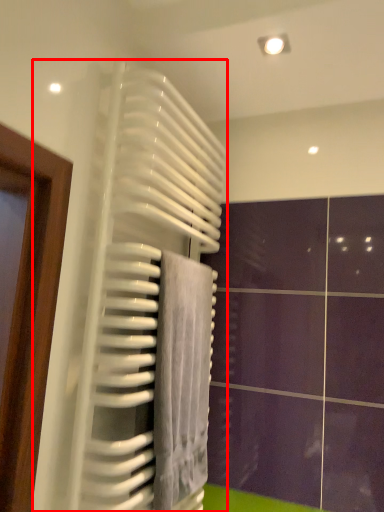
Question: From the image, what is the correct spatial relationship of radiator (annotated by the red box) in relation to towel?

Choices:
 (A) right
 (B) left

Answer: (B)